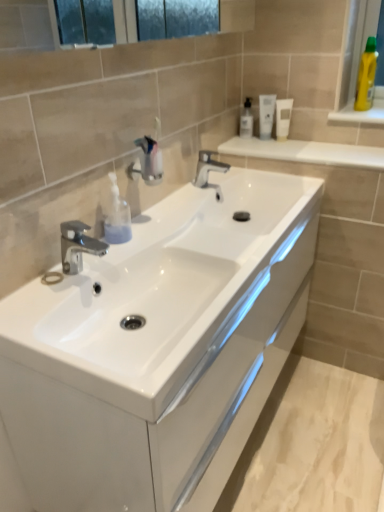
Question: Would you say white glossy cabinet at center is outside polished chrome tap at center, which is counted as the 2th tap, starting from the front?

Choices:
 (A) yes
 (B) no

Answer: (A)

Question: Is white glossy cabinet at center further to the viewer compared to polished chrome tap at center, which is counted as the 2th tap, starting from the front?

Choices:
 (A) yes
 (B) no

Answer: (B)

Question: Does white glossy cabinet at center have a lesser width compared to polished chrome tap at center, the second tap from the bottom?

Choices:
 (A) yes
 (B) no

Answer: (B)

Question: From the image's perspective, does white glossy cabinet at center appear lower than polished chrome tap at center, which is the 1th tap from top to bottom?

Choices:
 (A) no
 (B) yes

Answer: (B)

Question: From a real-world perspective, does white glossy cabinet at center stand above polished chrome tap at center, which is counted as the 2th tap, starting from the front?

Choices:
 (A) yes
 (B) no

Answer: (B)

Question: Is white glossy cabinet at center positioned before polished chrome tap at center, which is counted as the 2th tap, starting from the front?

Choices:
 (A) yes
 (B) no

Answer: (A)

Question: From the image's perspective, is translucent plastic soap dispenser at center, which is the 1th toiletry in bottom-to-top order, located above white glossy tube at upper right, which is the 2th mouthwash from left to right?

Choices:
 (A) yes
 (B) no

Answer: (B)

Question: Can you see translucent plastic soap dispenser at center, acting as the first toiletry starting from the front, touching white glossy tube at upper right, which is the 2th mouthwash from left to right?

Choices:
 (A) no
 (B) yes

Answer: (A)

Question: Does translucent plastic soap dispenser at center, which is the 1th toiletry in bottom-to-top order, turn towards white glossy tube at upper right, which ranks as the 2th mouthwash in right-to-left order?

Choices:
 (A) yes
 (B) no

Answer: (B)

Question: Does translucent plastic soap dispenser at center, placed as the second toiletry when sorted from top to bottom, have a greater height compared to white glossy tube at upper right, which ranks as the 2th mouthwash in right-to-left order?

Choices:
 (A) yes
 (B) no

Answer: (B)

Question: Is translucent plastic soap dispenser at center, which is the 1th toiletry in bottom-to-top order, far from white glossy tube at upper right, which ranks as the 2th mouthwash in right-to-left order?

Choices:
 (A) no
 (B) yes

Answer: (A)

Question: Considering the relative sizes of translucent plastic soap dispenser at center, which is the 1th toiletry in bottom-to-top order, and white glossy tube at upper right, which ranks as the 2th mouthwash in right-to-left order, in the image provided, is translucent plastic soap dispenser at center, which is the 1th toiletry in bottom-to-top order, shorter than white glossy tube at upper right, which ranks as the 2th mouthwash in right-to-left order,?

Choices:
 (A) yes
 (B) no

Answer: (A)

Question: Is white matte tube at upper center, placed as the 1th mouthwash when sorted from right to left, oriented towards white glossy tube at upper right, which is the 2th mouthwash from left to right?

Choices:
 (A) yes
 (B) no

Answer: (B)